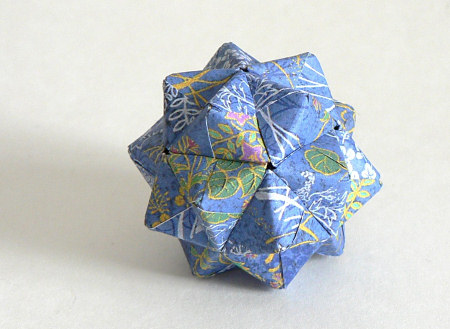
Find the location of `art`. art is located at coordinates (214, 162).